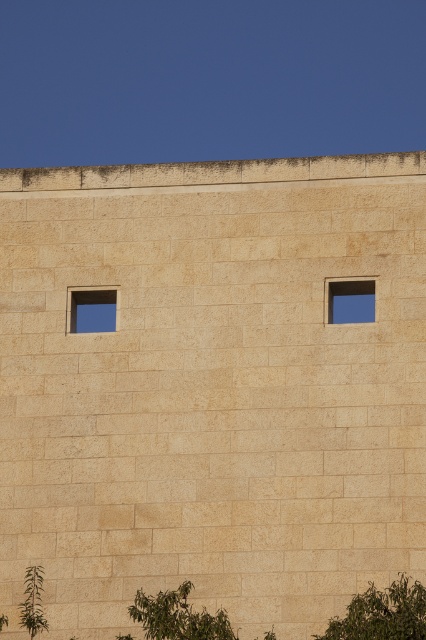
Question: Considering the real-world distances, which object is farthest from the transparent glass window at upper left?

Choices:
 (A) green leafy plant at lower left
 (B) green leafy tree at lower right

Answer: (B)

Question: Which is nearer to the green leafy plant at lower left?

Choices:
 (A) beige stone window at upper right
 (B) transparent glass window at upper left

Answer: (B)

Question: Which object is farther from the camera taking this photo?

Choices:
 (A) green leafy plant at lower left
 (B) green leafy tree at lower center
 (C) beige stone window at upper right
 (D) green leafy tree at lower right

Answer: (C)

Question: In this image, where is green leafy tree at lower right located relative to green leafy plant at lower left?

Choices:
 (A) above
 (B) below

Answer: (A)

Question: Is green leafy tree at lower right thinner than transparent glass window at upper left?

Choices:
 (A) yes
 (B) no

Answer: (B)

Question: Does green leafy tree at lower center appear on the left side of beige stone window at upper right?

Choices:
 (A) no
 (B) yes

Answer: (B)